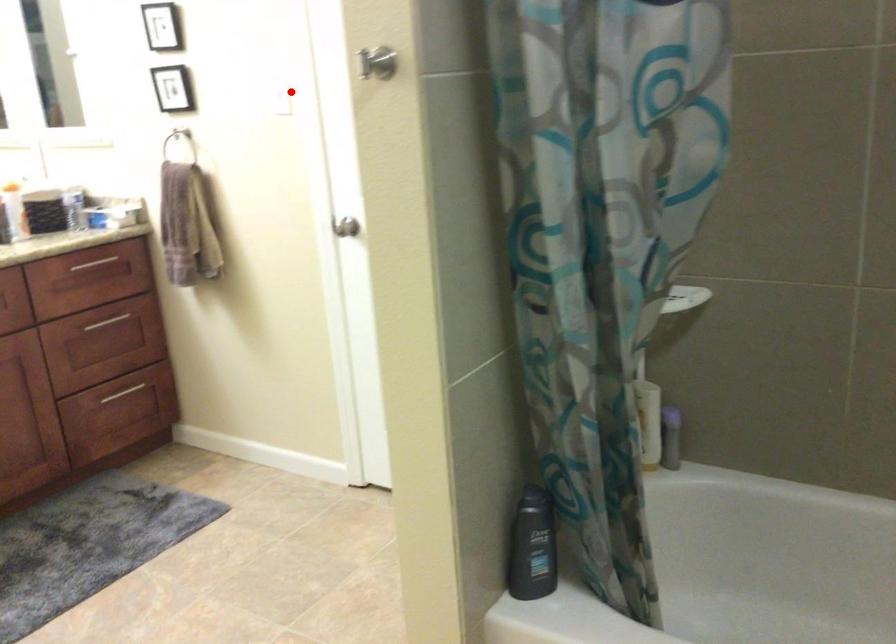
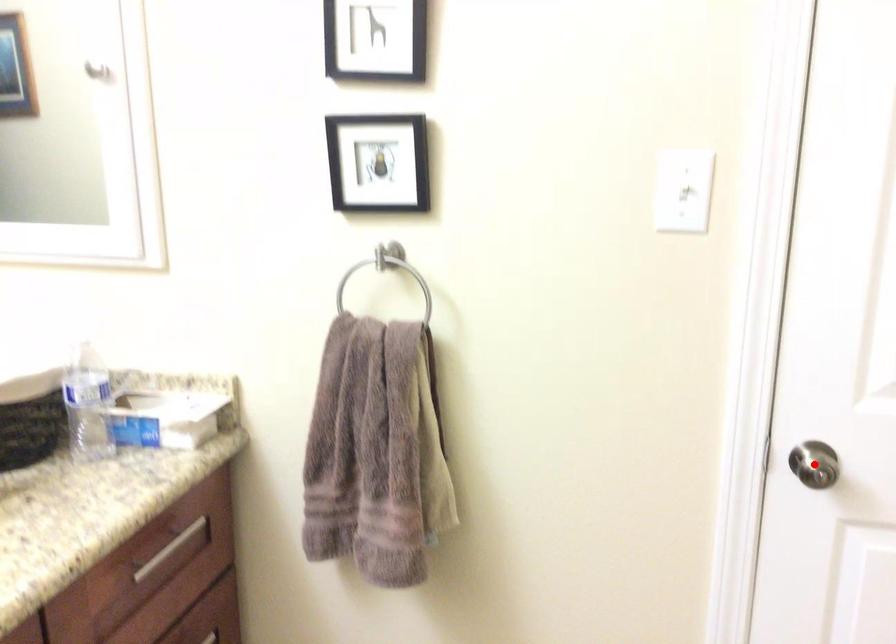
I am providing you with two images of the same scene from different viewpoints. A red point is marked on the first image and another point is marked on the second image. Is the red point in image1 aligned with the point shown in image2?

No